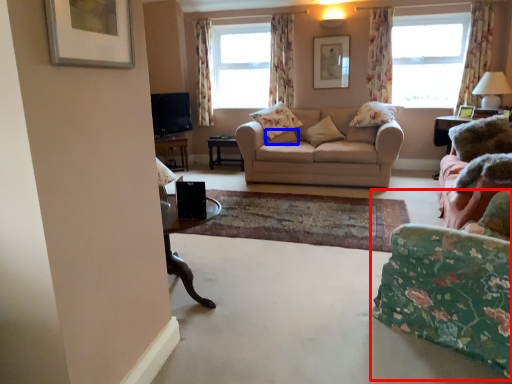
Question: Which of the following is the closest to the observer, chair (highlighted by a red box) or pillow (highlighted by a blue box)?

Choices:
 (A) chair
 (B) pillow

Answer: (A)